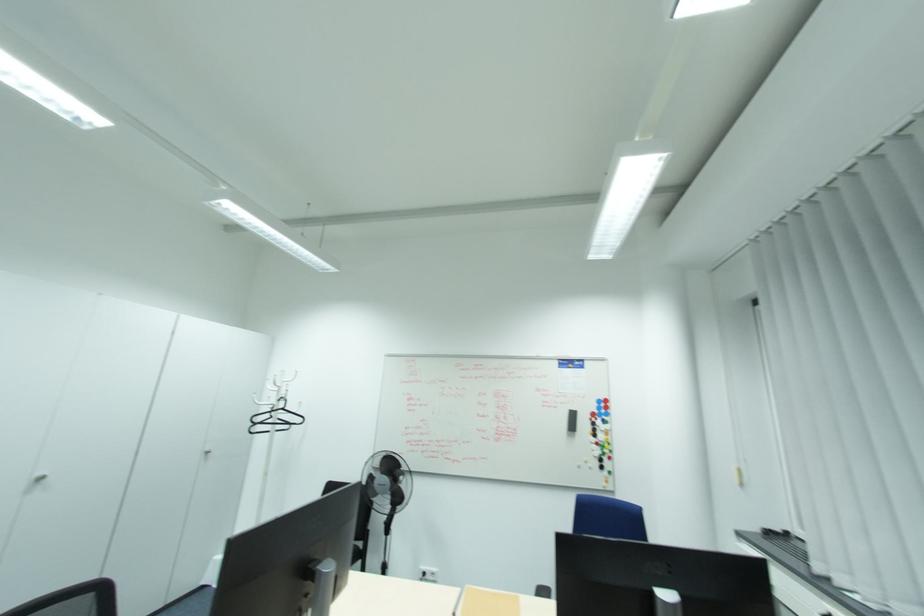
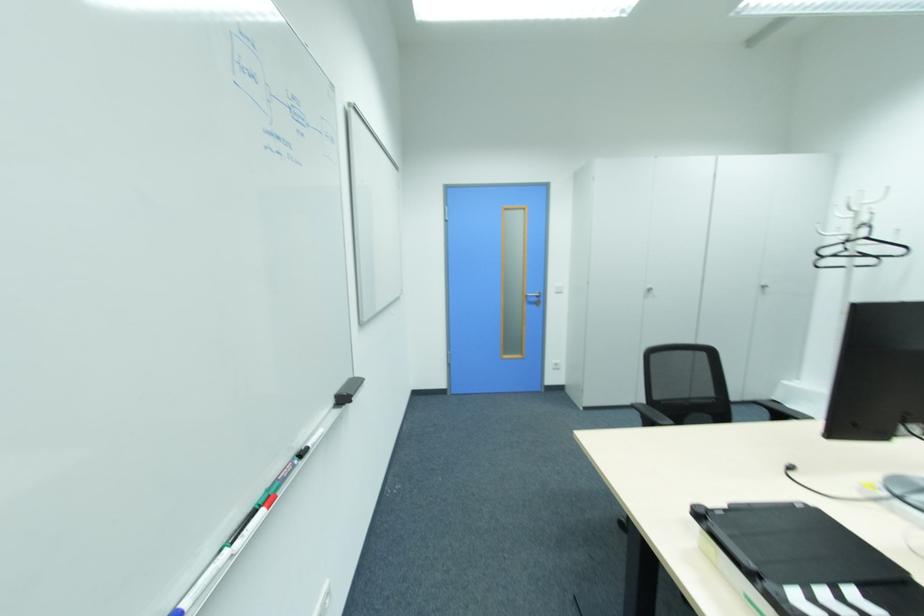
Locate, in the second image, the point that corresponds to point (284, 408) in the first image.

(865, 238)